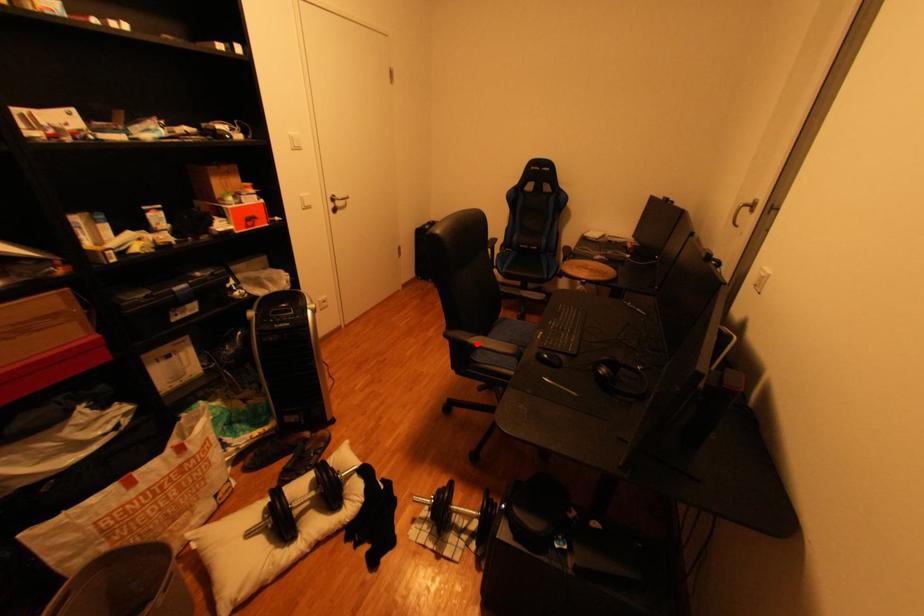
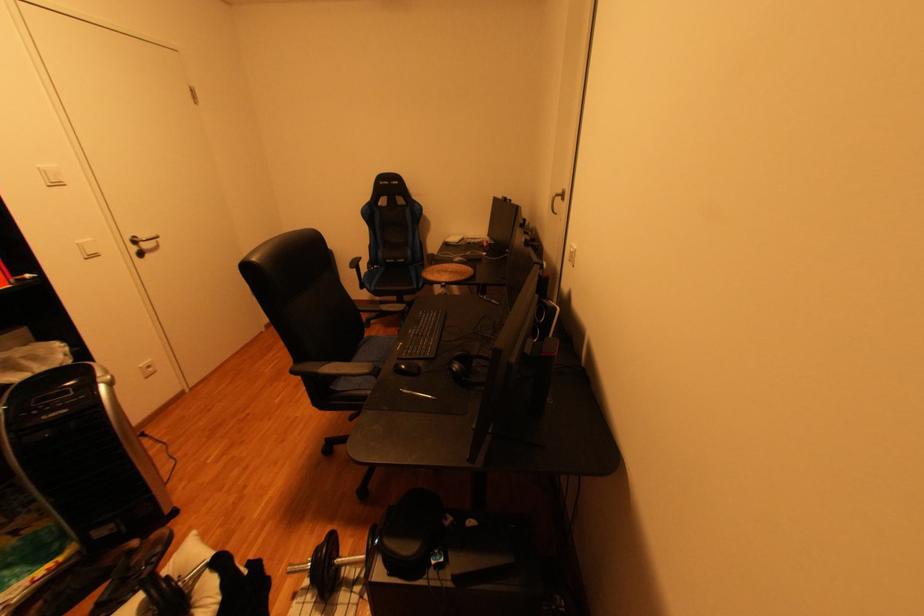
Locate, in the second image, the point that corresponds to the highlighted location in the first image.

(325, 375)